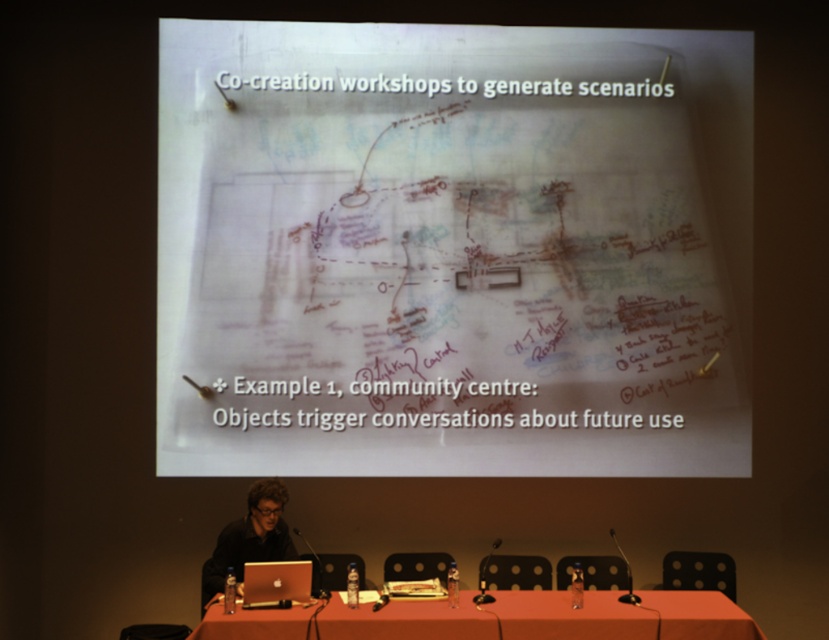
Question: Based on their relative distances, which object is nearer to the white paper at upper center?

Choices:
 (A) black matte laptop at lower left
 (B) silver metallic laptop at center

Answer: (A)

Question: Which of the following is the closest to the observer?

Choices:
 (A) black matte laptop at lower left
 (B) white paper at upper center

Answer: (A)

Question: Which point is closer to the camera?

Choices:
 (A) white paper at upper center
 (B) black matte laptop at lower left

Answer: (B)

Question: Is white paper at upper center smaller than black matte laptop at lower left?

Choices:
 (A) no
 (B) yes

Answer: (A)

Question: Observing the image, what is the correct spatial positioning of white paper at upper center in reference to smooth orange table at center?

Choices:
 (A) left
 (B) right

Answer: (A)

Question: Is white paper at upper center to the right of smooth orange table at center from the viewer's perspective?

Choices:
 (A) yes
 (B) no

Answer: (B)